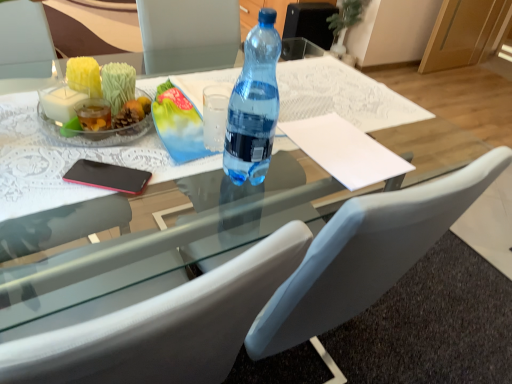
The image size is (512, 384). What do you see at coordinates (345, 150) in the screenshot?
I see `white paper at center` at bounding box center [345, 150].

Where is `transparent glass table at center`? transparent glass table at center is located at coordinates (66, 161).

You are a GUI agent. You are given a task and a screenshot of the screen. Output one action in this format:
    pyautogui.click(x=<x>, y=<y>)
    Task: Click on the white leather chair at center
    
    Given the screenshot: What is the action you would take?
    pyautogui.click(x=366, y=255)

You are a GUI agent. You are given a task and a screenshot of the screen. Output one action in this format:
    pyautogui.click(x=<x>, y=<y>)
    Task: Click on the white paper at center
    
    Given the screenshot: What is the action you would take?
    pyautogui.click(x=345, y=150)

From the image's perspective, is transparent plastic bottle at center located above or below transparent glass table at center?

Based on their image positions, transparent plastic bottle at center is located beneath transparent glass table at center.

Considering the sizes of objects transparent plastic bottle at center and transparent glass table at center in the image provided, who is wider, transparent plastic bottle at center or transparent glass table at center?

transparent glass table at center.

In the scene shown: Who is more distant, transparent plastic bottle at center or transparent glass table at center?

transparent glass table at center is behind.

From a real-world perspective, is transparent plastic bottle at center above or below transparent glass table at center?

In terms of real-world spatial position, transparent plastic bottle at center is above transparent glass table at center.

Considering the relative sizes of white leather chair at center and white paper at center in the image provided, is white leather chair at center wider than white paper at center?

Yes.

From the image's perspective, between white leather chair at center and white paper at center, who is located below?

white leather chair at center appears lower in the image.

In the image, is white leather chair at center positioned in front of or behind white paper at center?

white leather chair at center is positioned closer to the viewer than white paper at center.

Is point (308, 315) farther from camera compared to point (318, 131)?

No, it is not.

Is white paper at center not within transparent glass table at center?

No, white paper at center is inside transparent glass table at center's boundary.

Considering the points (326, 134) and (28, 139), which point is behind, point (326, 134) or point (28, 139)?

The point (326, 134) is more distant.

This screenshot has height=384, width=512. What are the coordinates of `round table lying on the left of white paper at center` in the screenshot? It's located at (66, 161).

Is transparent glass table at center oriented away from transparent plastic bottle at center?

No, transparent glass table at center is not facing the opposite direction of transparent plastic bottle at center.

From their relative heights in the image, would you say transparent glass table at center is taller or shorter than transparent plastic bottle at center?

transparent glass table at center is shorter than transparent plastic bottle at center.

The image size is (512, 384). Find the location of `bottle in front of the transparent glass table at center`. bottle in front of the transparent glass table at center is located at coordinates pyautogui.click(x=254, y=105).

Can you see transparent glass table at center touching white paper at center?

No, transparent glass table at center is not next to white paper at center.

Can white paper at center be found inside transparent glass table at center?

Yes, transparent glass table at center contains white paper at center.

Is transparent glass table at center positioned in front of white paper at center?

Yes, transparent glass table at center is closer to the viewer.

Based on the photo, looking at the image, does white paper at center seem bigger or smaller compared to white leather chair at center?

Clearly, white paper at center is smaller in size than white leather chair at center.

You are a GUI agent. You are given a task and a screenshot of the screen. Output one action in this format:
    pyautogui.click(x=<x>, y=<y>)
    Task: Click on the notepad to the right of white leather chair at center
    
    Given the screenshot: What is the action you would take?
    pyautogui.click(x=345, y=150)

Is the depth of white paper at center greater than that of white leather chair at center?

That is True.

What's the angular difference between white paper at center and white leather chair at center's facing directions?

The facing directions of white paper at center and white leather chair at center are 0.484 degrees apart.

Who is more distant, white paper at center or transparent plastic bottle at center?

white paper at center.

From the image's perspective, which one is positioned higher, white paper at center or transparent plastic bottle at center?

transparent plastic bottle at center, from the image's perspective.

Considering the relative sizes of white paper at center and transparent plastic bottle at center in the image provided, is white paper at center thinner than transparent plastic bottle at center?

In fact, white paper at center might be wider than transparent plastic bottle at center.

This screenshot has height=384, width=512. I want to click on bottle located in front of the white paper at center, so click(x=254, y=105).

Identify the location of bottle that is on the right side of transparent glass table at center. The width and height of the screenshot is (512, 384). (254, 105).

Image resolution: width=512 pixels, height=384 pixels. Find the location of `notepad above the white leather chair at center (from a real-world perspective)`. notepad above the white leather chair at center (from a real-world perspective) is located at coordinates (345, 150).

When comparing their distances from white paper at center, does transparent plastic bottle at center or white leather chair at center seem further?

white leather chair at center.

Looking at the image, which one is located further to transparent glass table at center, white leather chair at center or transparent plastic bottle at center?

white leather chair at center is further to transparent glass table at center.

From the image, which object appears to be farther from white paper at center, transparent glass table at center or white leather chair at center?

The object further to white paper at center is white leather chair at center.

Estimate the real-world distances between objects in this image. Which object is further from transparent glass table at center, transparent plastic bottle at center or white paper at center?

transparent plastic bottle at center is positioned further to the anchor transparent glass table at center.

When comparing their distances from white leather chair at center, does white paper at center or transparent glass table at center seem further?

Based on the image, transparent glass table at center appears to be further to white leather chair at center.

Looking at the image, which one is located further to transparent glass table at center, transparent plastic bottle at center or white leather chair at center?

white leather chair at center lies further to transparent glass table at center than the other object.

Which object lies nearer to the anchor point transparent glass table at center, white paper at center or transparent plastic bottle at center?

Among the two, white paper at center is located nearer to transparent glass table at center.

Estimate the real-world distances between objects in this image. Which object is further from transparent plastic bottle at center, white paper at center or transparent glass table at center?

transparent glass table at center is positioned further to the anchor transparent plastic bottle at center.

Find the location of `bottle between transparent glass table at center and white leather chair at center in the vertical direction`. bottle between transparent glass table at center and white leather chair at center in the vertical direction is located at coordinates (254, 105).

You are a GUI agent. You are given a task and a screenshot of the screen. Output one action in this format:
    pyautogui.click(x=<x>, y=<y>)
    Task: Click on the notepad between transparent glass table at center and white leather chair at center from top to bottom
    This screenshot has width=512, height=384.
    Given the screenshot: What is the action you would take?
    (x=345, y=150)

Find the location of a particular element. bottle between white leather chair at center and white paper at center along the z-axis is located at coordinates (254, 105).

You are a GUI agent. You are given a task and a screenshot of the screen. Output one action in this format:
    pyautogui.click(x=<x>, y=<y>)
    Task: Click on the bottle situated between transparent glass table at center and white paper at center from left to right
    The width and height of the screenshot is (512, 384).
    Given the screenshot: What is the action you would take?
    tap(254, 105)